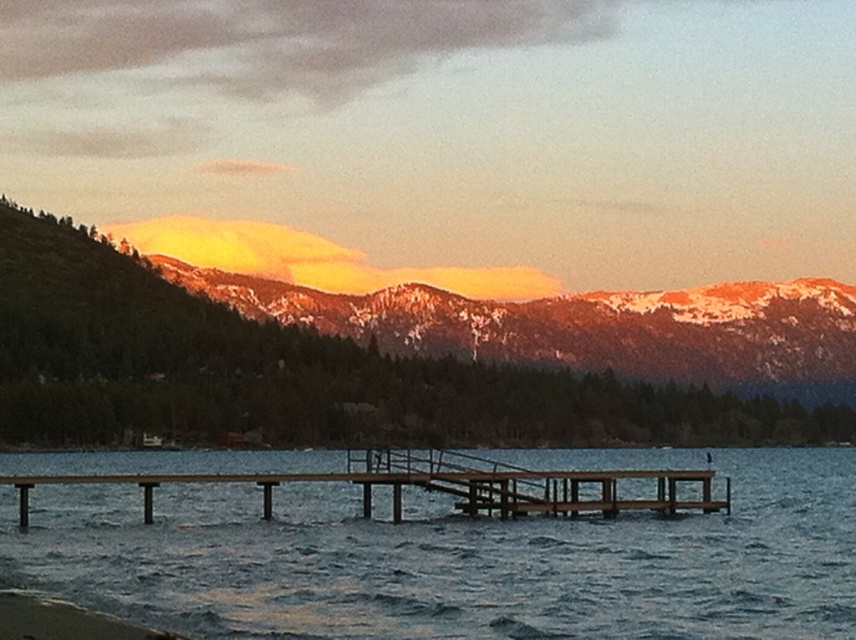
Consider the image. You are standing on the wooden dock at center and want to see the smooth blue water at center. In which direction should you look?

You should look downward because the smooth blue water at center is below the wooden dock at center.

You are a photographer planning to capture the wooden dock at center and the sandy brown mountains at upper center in a single shot. Based on their positions, which object will appear closer to the camera in the photo?

The sandy brown mountains at upper center will appear closer to the camera because the wooden dock at center is positioned behind them.